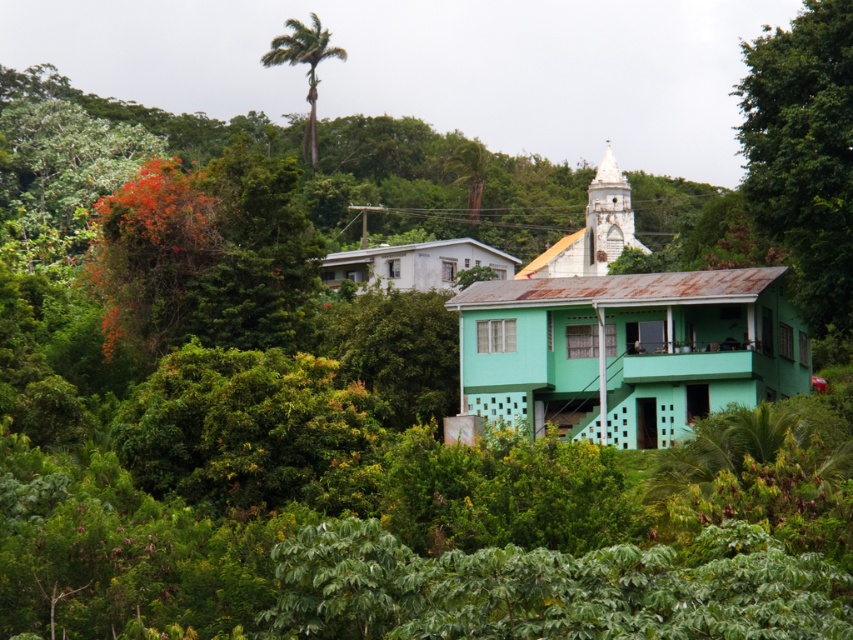
Is green leafy tree at right to the left of green leafy palm tree at upper center from the viewer's perspective?

In fact, green leafy tree at right is to the right of green leafy palm tree at upper center.

Between green leafy tree at right and green leafy palm tree at upper center, which one is positioned lower?

Positioned lower is green leafy tree at right.

The height and width of the screenshot is (640, 853). What do you see at coordinates (804, 154) in the screenshot? I see `green leafy tree at right` at bounding box center [804, 154].

Image resolution: width=853 pixels, height=640 pixels. I want to click on green leafy tree at right, so click(x=804, y=154).

Who is taller, white matte church at center or green leafy tree at right?

With more height is green leafy tree at right.

Can you confirm if white matte church at center is bigger than green leafy tree at right?

Incorrect, white matte church at center is not larger than green leafy tree at right.

This screenshot has width=853, height=640. In order to click on white matte church at center in this screenshot , I will do `click(624, 337)`.

Locate an element on the screen. white matte church at center is located at coordinates (624, 337).

Is point (723, 296) behind point (311, 164)?

No, (723, 296) is closer to viewer.

Between point (589, 378) and point (337, 51), which one is positioned in front?

Point (589, 378) is more forward.

Image resolution: width=853 pixels, height=640 pixels. What are the coordinates of `white matte church at center` in the screenshot? It's located at (624, 337).

Where is `white matte church at center`? This screenshot has height=640, width=853. white matte church at center is located at coordinates (624, 337).